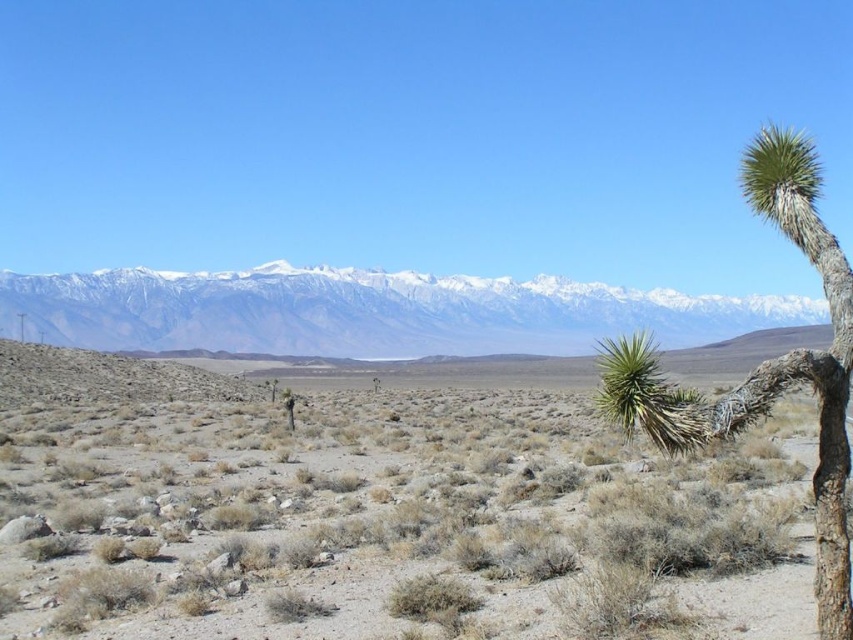
How much distance is there between snowy white mountain range at upper center and green spiky tree at right?

snowy white mountain range at upper center and green spiky tree at right are 249.55 meters apart.

In the scene shown: Is snowy white mountain range at upper center smaller than green spiky tree at right?

Incorrect, snowy white mountain range at upper center is not smaller in size than green spiky tree at right.

The height and width of the screenshot is (640, 853). What are the coordinates of `snowy white mountain range at upper center` in the screenshot? It's located at (368, 312).

Identify the location of snowy white mountain range at upper center. (368, 312).

Is point (689, 472) behind point (206, 342)?

That is False.

Is brown dry grass at center to the right of snowy white mountain range at upper center from the viewer's perspective?

Incorrect, brown dry grass at center is not on the right side of snowy white mountain range at upper center.

Is point (161, 616) positioned after point (192, 340)?

No.

The width and height of the screenshot is (853, 640). What are the coordinates of `brown dry grass at center` in the screenshot? It's located at (379, 513).

Based on the photo, is brown dry grass at center smaller than green spiky tree at right?

Incorrect, brown dry grass at center is not smaller in size than green spiky tree at right.

Looking at this image, who is shorter, brown dry grass at center or green spiky tree at right?

brown dry grass at center

This screenshot has height=640, width=853. In order to click on brown dry grass at center in this screenshot , I will do `click(379, 513)`.